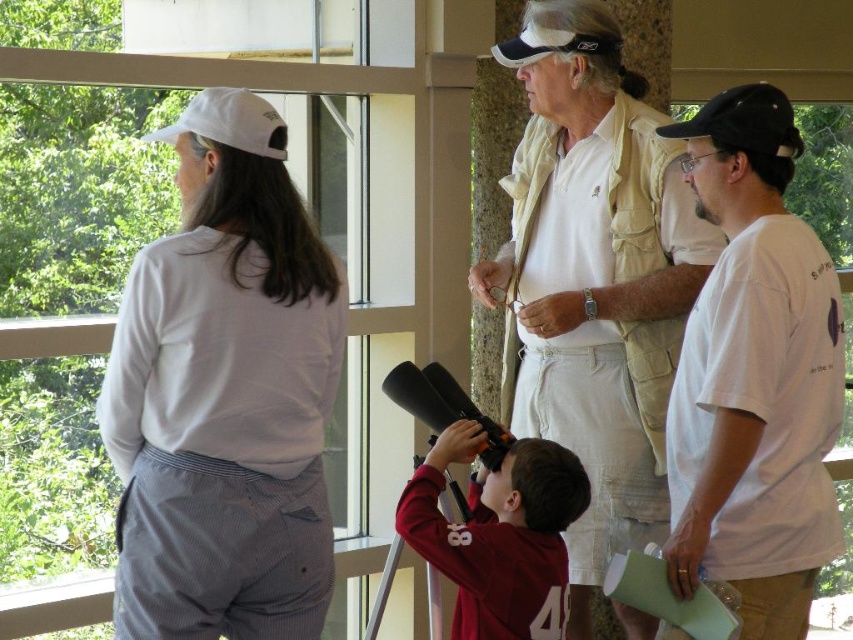
Which is more to the left, maroon jersey at center or black fabric baseball cap at upper right?

maroon jersey at center is more to the left.

Which is below, maroon jersey at center or black fabric baseball cap at upper right?

maroon jersey at center is lower down.

Which is in front, point (466, 556) or point (767, 115)?

Point (767, 115) is in front.

In order to click on maroon jersey at center in this screenshot , I will do `click(498, 532)`.

Looking at this image, which is above, white cotton shirt at upper left or maroon jersey at center?

white cotton shirt at upper left

Does white cotton shirt at upper left appear on the left side of maroon jersey at center?

Correct, you'll find white cotton shirt at upper left to the left of maroon jersey at center.

Identify the location of white cotton shirt at upper left. (225, 394).

At what (x,y) coordinates should I click in order to perform the action: click on white cotton shirt at upper left. Please return your answer as a coordinate pair (x, y). The width and height of the screenshot is (853, 640). Looking at the image, I should click on (225, 394).

Who is taller, white cotton t-shirt at right or maroon jersey at center?

Standing taller between the two is white cotton t-shirt at right.

Which is more to the left, white cotton t-shirt at right or maroon jersey at center?

Positioned to the left is maroon jersey at center.

Is point (793, 275) positioned in front of point (505, 512)?

Yes, it is.

Find the location of a particular element. white cotton t-shirt at right is located at coordinates (753, 376).